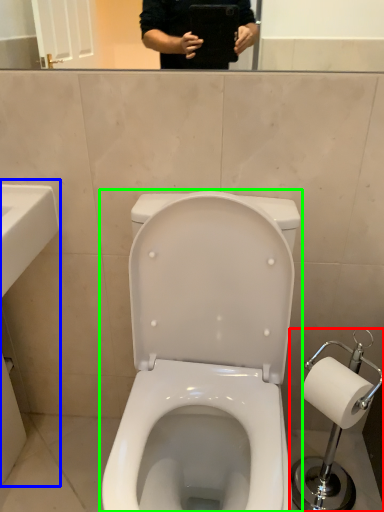
Question: Considering the real-world distances, which object is closest to scale (highlighted by a red box)? sink (highlighted by a blue box) or toilet (highlighted by a green box).

Choices:
 (A) sink
 (B) toilet

Answer: (B)